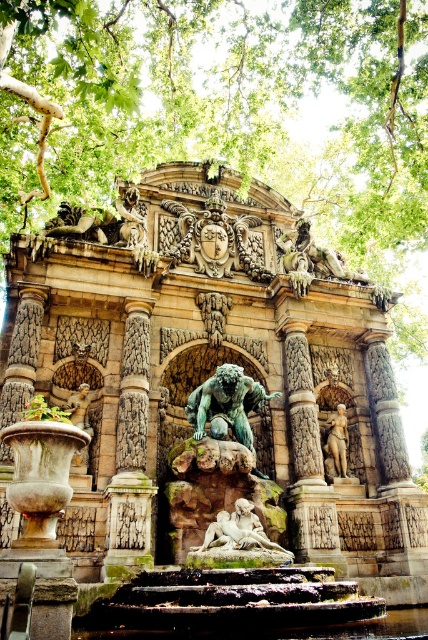
Question: Is green leafy tree at upper center above carved stone column at center?

Choices:
 (A) yes
 (B) no

Answer: (A)

Question: Does carved stone column at center have a smaller size compared to polished stone statue at center?

Choices:
 (A) no
 (B) yes

Answer: (A)

Question: Which object appears farthest from the camera in this image?

Choices:
 (A) carved stone fountain at center
 (B) bronze statue at center
 (C) green leafy tree at upper center

Answer: (B)

Question: Estimate the real-world distances between objects in this image. Which object is farther from the bronze statue at center?

Choices:
 (A) polished stone statue at center
 (B) carved stone fountain at center

Answer: (B)

Question: Which of the following is the closest to the observer?

Choices:
 (A) polished stone statue at center
 (B) bronze statue at center
 (C) green patina stone gargoyle at center

Answer: (B)

Question: Considering the relative positions of green leafy tree at upper center and bronze statue at center in the image provided, where is green leafy tree at upper center located with respect to bronze statue at center?

Choices:
 (A) right
 (B) left

Answer: (A)